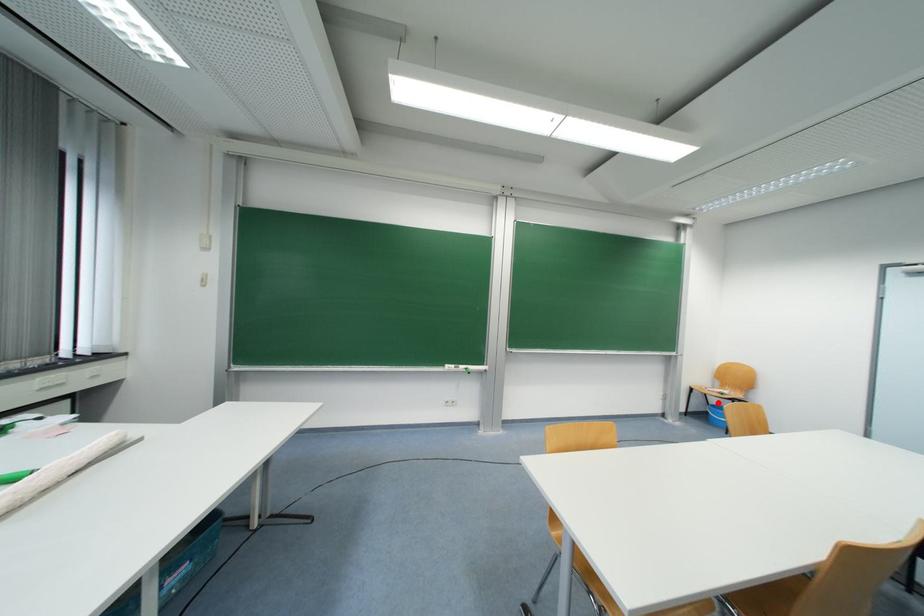
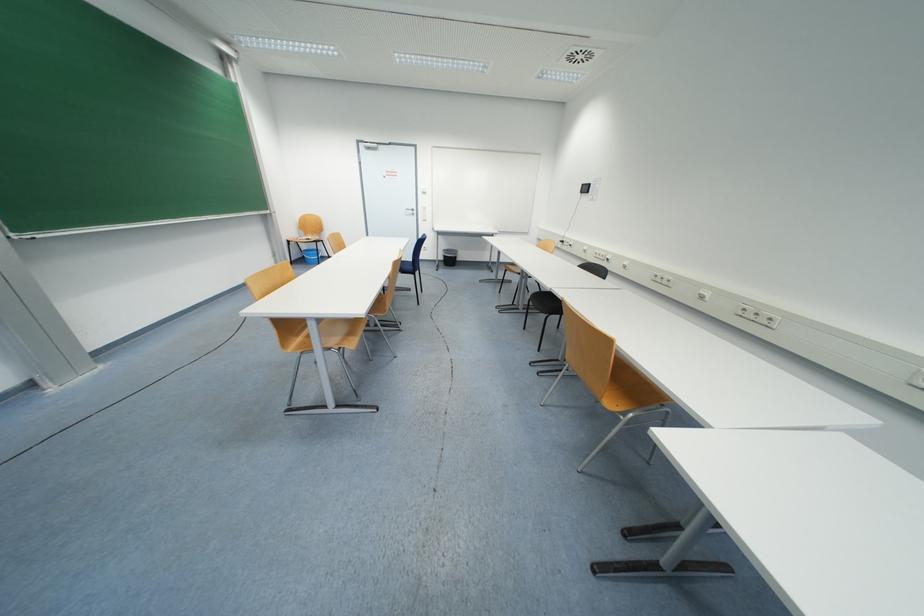
Question: I am providing you with two images of the same scene from different viewpoints. A red point is shown in image1. For the corresponding object point in image2, is it positioned nearer or farther from the camera?

Choices:
 (A) Nearer
 (B) Farther

Answer: (B)